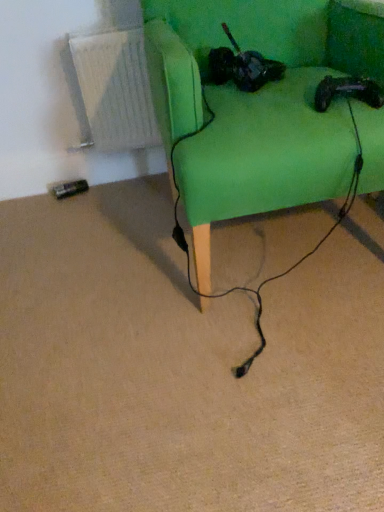
The image size is (384, 512). I want to click on green fabric couch at center, so click(256, 106).

The image size is (384, 512). What do you see at coordinates (256, 106) in the screenshot? I see `green fabric couch at center` at bounding box center [256, 106].

You are a GUI agent. You are given a task and a screenshot of the screen. Output one action in this format:
    pyautogui.click(x=<x>, y=<y>)
    Task: Click on the green fabric couch at center
    
    Given the screenshot: What is the action you would take?
    pyautogui.click(x=256, y=106)